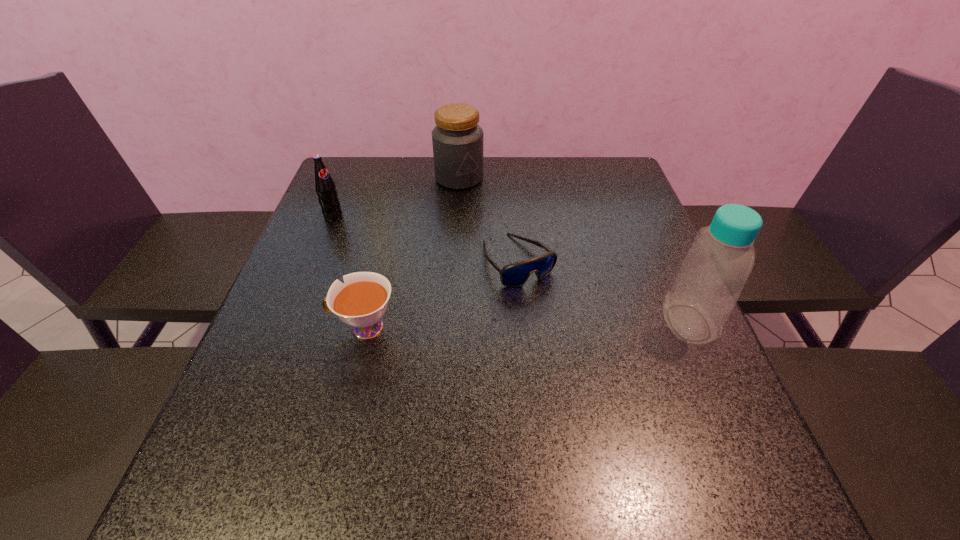
Identify the location of free spot at the near left corner of the desktop. (248, 426).

In the image, there is a desktop. At what (x,y) coordinates should I click in order to perform the action: click on free space at the far right corner. Please return your answer as a coordinate pair (x, y). This screenshot has height=540, width=960. Looking at the image, I should click on (620, 177).

Locate an element on the screen. This screenshot has height=540, width=960. free spot between the third nearest object and the pop is located at coordinates (426, 238).

This screenshot has width=960, height=540. What are the coordinates of `unoccupied area between the jar and the sunglasses` in the screenshot? It's located at (489, 219).

Locate an element on the screen. The height and width of the screenshot is (540, 960). vacant area that lies between the teacup and the tallest object is located at coordinates (526, 325).

Where is `vacant area between the shortest object and the teacup`? vacant area between the shortest object and the teacup is located at coordinates (442, 294).

This screenshot has height=540, width=960. Identify the location of free space between the shortest object and the jar. (489, 219).

At what (x,y) coordinates should I click in order to perform the action: click on unoccupied area between the teacup and the shortest object. Please return your answer as a coordinate pair (x, y). This screenshot has height=540, width=960. Looking at the image, I should click on (442, 294).

In order to click on free space that is in between the tallest object and the second object from left to right in this screenshot , I will do `click(526, 325)`.

The image size is (960, 540). Find the location of `free area in between the fourth nearest object and the sunglasses`. free area in between the fourth nearest object and the sunglasses is located at coordinates pyautogui.click(x=426, y=238).